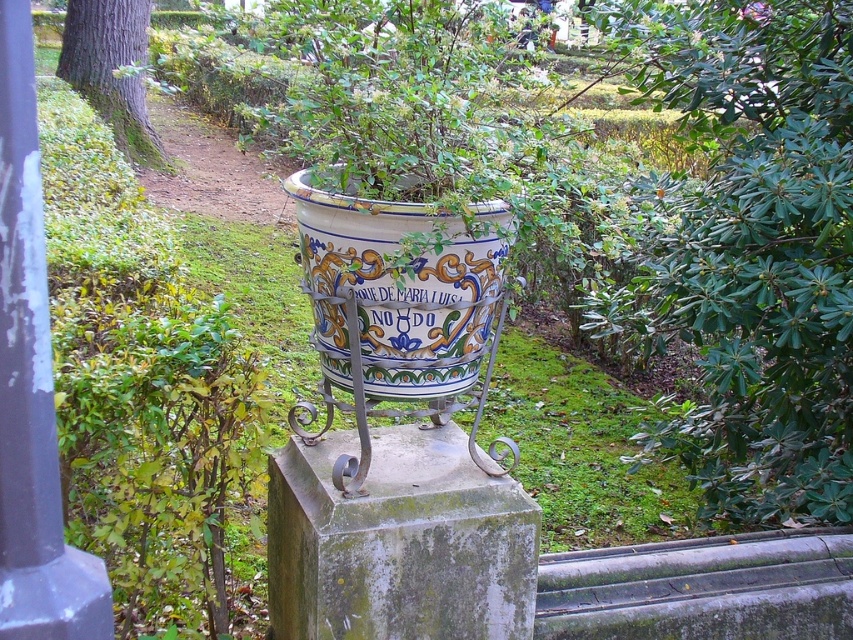
Question: Is green leafy bush at upper right smaller than smooth gray pole at left?

Choices:
 (A) yes
 (B) no

Answer: (B)

Question: Among these objects, which one is farthest from the camera?

Choices:
 (A) brown rough bark at upper left
 (B) green leafy bush at upper right
 (C) smooth gray pole at left

Answer: (A)

Question: Among these objects, which one is nearest to the camera?

Choices:
 (A) green leafy bush at upper right
 (B) brown rough bark at upper left

Answer: (A)

Question: Can you confirm if green leafy bush at upper right is wider than smooth gray pole at left?

Choices:
 (A) yes
 (B) no

Answer: (A)

Question: Does smooth gray pole at left appear over brown rough bark at upper left?

Choices:
 (A) yes
 (B) no

Answer: (B)

Question: Which of the following is the farthest from the observer?

Choices:
 (A) smooth gray pole at left
 (B) green leafy bush at upper right

Answer: (B)